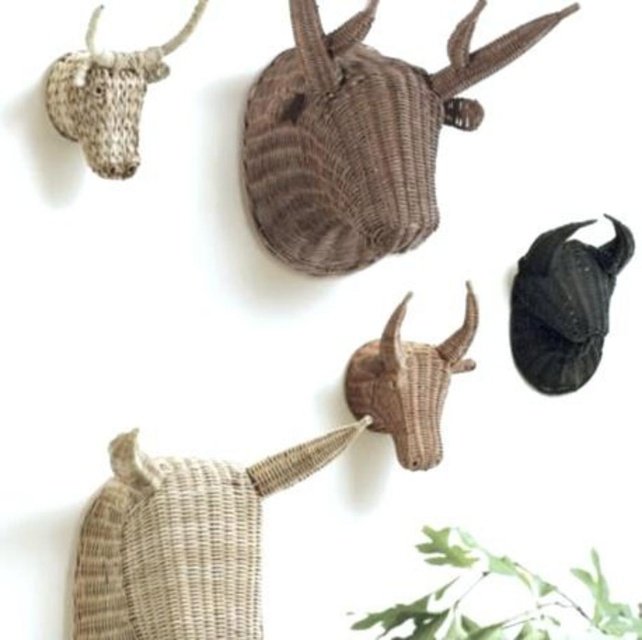
Which is in front, point (525, 316) or point (107, 58)?

Point (107, 58) is more forward.

Between black matte horn at upper center and white woven bull head at upper left, which one has less height?

Standing shorter between the two is white woven bull head at upper left.

Is point (512, 305) less distant than point (64, 99)?

No, it is behind (64, 99).

Find the location of a particular element. The width and height of the screenshot is (642, 640). black matte horn at upper center is located at coordinates (564, 305).

Between rattan horned animal head at center and white woven bull head at upper left, which one appears on the right side from the viewer's perspective?

From the viewer's perspective, rattan horned animal head at center appears more on the right side.

Between point (426, 376) and point (126, 72), which one is positioned in front?

Point (126, 72)

Is point (437, 388) closer to viewer compared to point (132, 74)?

No.

Where is `rattan horned animal head at center`? This screenshot has width=642, height=640. rattan horned animal head at center is located at coordinates (408, 385).

Does point (291, 193) come behind point (566, 349)?

No, it is in front of (566, 349).

Between rattan textured bull head at upper center and black matte horn at upper center, which one appears on the left side from the viewer's perspective?

rattan textured bull head at upper center

Find the location of a particular element. rattan textured bull head at upper center is located at coordinates (358, 138).